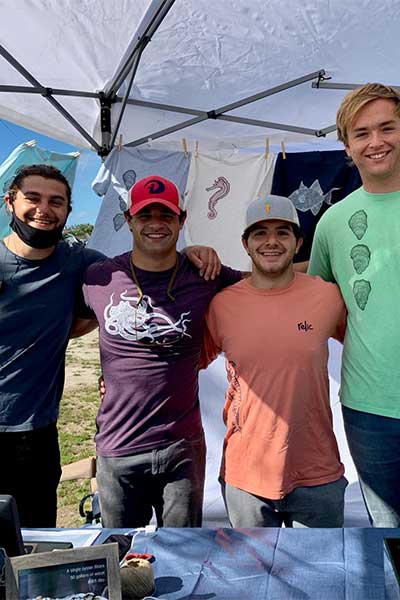
Identify the location of frame. (73, 580).